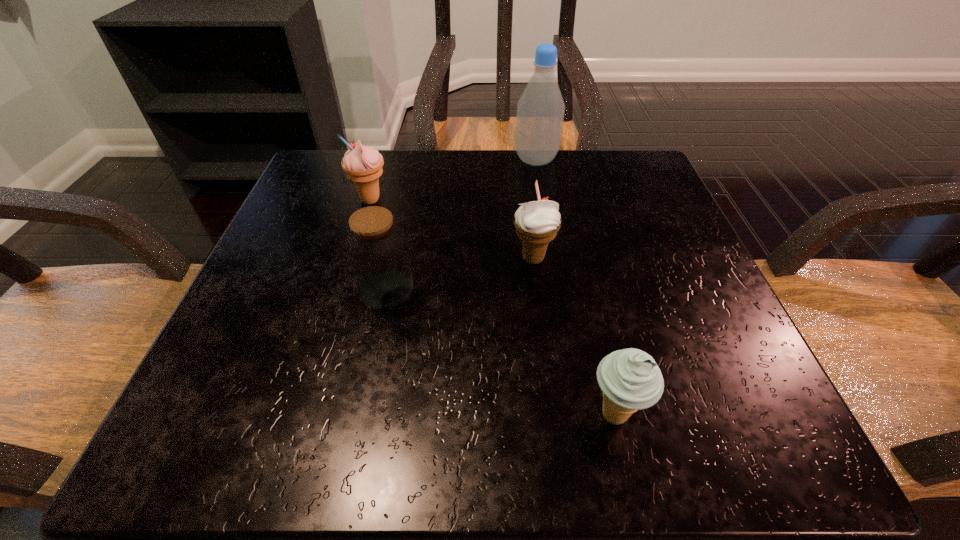
Find the location of a particular element. This screenshot has width=960, height=540. vacant area between the jar and the nearest object is located at coordinates (500, 352).

Locate an element on the screen. The height and width of the screenshot is (540, 960). the third closest object relative to the jar is located at coordinates 630,379.

Identify which object is located as the fourth nearest to the nearest object. Please provide its 2D coordinates. Your answer should be formatted as a tuple, i.e. [(x, y)], where the tuple contains the x and y coordinates of a point satisfying the conditions above.

[(540, 110)]

Identify which icecream is the closest to the second nearest icecream. Please provide its 2D coordinates. Your answer should be formatted as a tuple, i.e. [(x, y)], where the tuple contains the x and y coordinates of a point satisfying the conditions above.

[(630, 379)]

Choose which icecream is the second nearest neighbor to the jar. Please provide its 2D coordinates. Your answer should be formatted as a tuple, i.e. [(x, y)], where the tuple contains the x and y coordinates of a point satisfying the conditions above.

[(363, 165)]

Identify the location of vacant area in the image that satisfies the following two spatial constraints: 1. on the front side of the leftmost icecream; 2. on the left side of the second icecream from right to left. (352, 258).

Where is `vacant region that satisfies the following two spatial constraints: 1. on the back side of the farthest object; 2. on the left side of the second icecream from right to left`? vacant region that satisfies the following two spatial constraints: 1. on the back side of the farthest object; 2. on the left side of the second icecream from right to left is located at coordinates (521, 160).